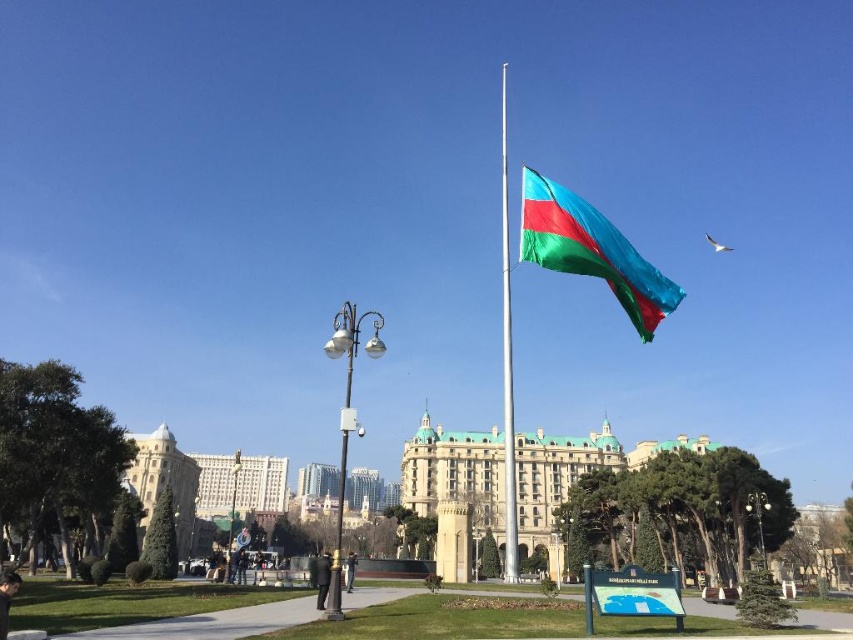
You are standing in the outdoor scene and want to take a photo of the polished silver flag pole at center without the dark gray jeans at center appearing in the frame. Which direction should you move to achieve this?

Move to the right of the polished silver flag pole at center so that the dark gray jeans at center, which is to the left of the flag pole, will be out of the frame.

You are a city planner assessing the central square. You see the metallic streetlight at center and the matte black lamp post at center. Which one is bigger in size?

The metallic streetlight at center is larger in size compared to the matte black lamp post at center.